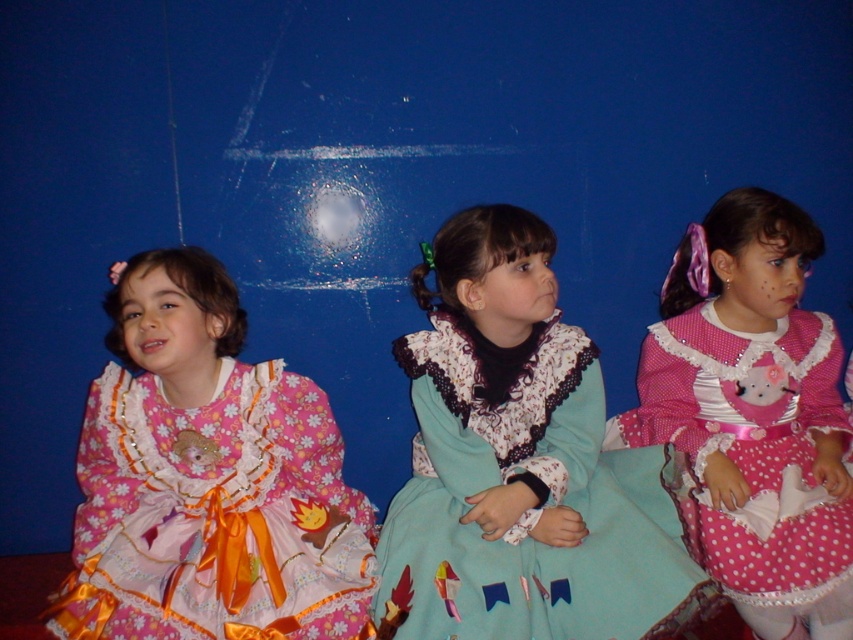
Question: Which of the following is the closest to the observer?

Choices:
 (A) (670, 499)
 (B) (155, 476)

Answer: (B)

Question: Which object appears closest to the camera in this image?

Choices:
 (A) pink polka dot dress at center
 (B) pink satin dress at left

Answer: (B)

Question: Can you confirm if pink satin dress at left is bigger than teal satin dress at center?

Choices:
 (A) no
 (B) yes

Answer: (A)

Question: From the image, what is the correct spatial relationship of pink satin dress at left in relation to teal satin dress at center?

Choices:
 (A) left
 (B) right

Answer: (A)

Question: Which point appears closest to the camera in this image?

Choices:
 (A) pos(274,624)
 (B) pos(785,497)

Answer: (A)

Question: Is teal satin dress at center closer to the viewer compared to pink polka dot dress at center?

Choices:
 (A) no
 (B) yes

Answer: (B)